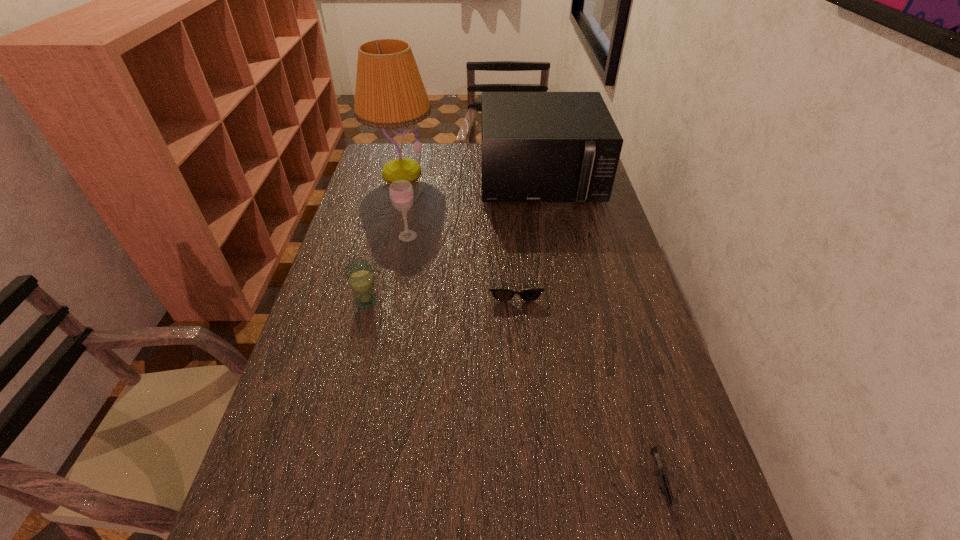
This screenshot has height=540, width=960. In the image, there is a desktop. What are the coordinates of `free space at the far edge` in the screenshot? It's located at (472, 168).

What are the coordinates of `vacant region at the left edge of the desktop` in the screenshot? It's located at (383, 193).

Identify the location of vacant region at the right edge of the desktop. (597, 245).

I want to click on free space at the far left corner of the desktop, so click(x=392, y=147).

What are the coordinates of `free spot between the third shortest object and the fourth shortest object` in the screenshot? It's located at (387, 268).

The width and height of the screenshot is (960, 540). I want to click on vacant area between the second tallest object and the wineglass, so click(x=474, y=207).

I want to click on empty location between the wineglass and the gun, so click(x=535, y=365).

Locate an element on the screen. free spot between the third shortest object and the fifth shortest object is located at coordinates (453, 240).

You are a GUI agent. You are given a task and a screenshot of the screen. Output one action in this format:
    pyautogui.click(x=<x>, y=<y>)
    Task: Click on the unoccupied area between the sunglasses and the nearest object
    
    Given the screenshot: What is the action you would take?
    pyautogui.click(x=588, y=388)

The image size is (960, 540). What are the coordinates of `vacant space that's between the sunglasses and the gun` in the screenshot? It's located at (588, 388).